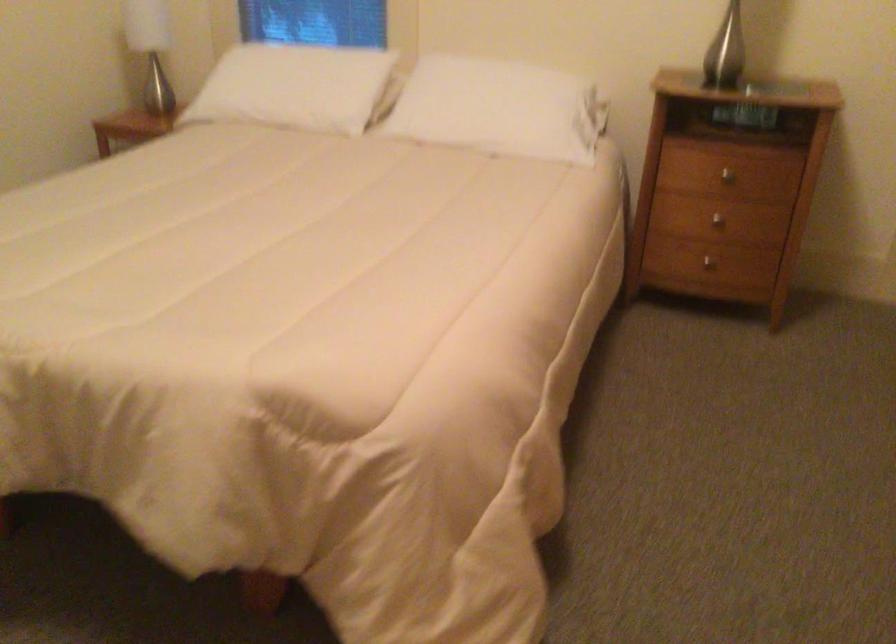
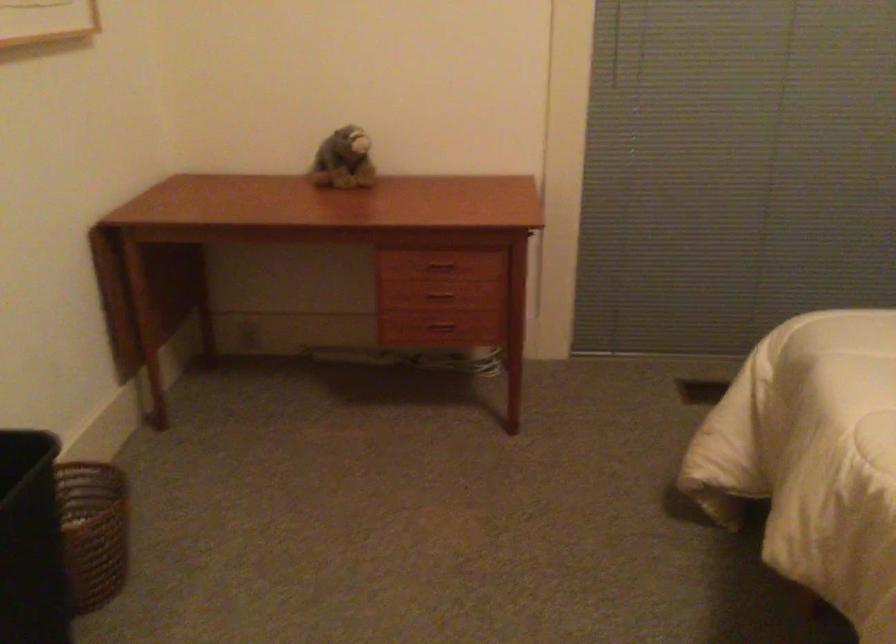
Question: How did the camera likely rotate?

Choices:
 (A) Left
 (B) Right
 (C) Up
 (D) Down

Answer: (A)